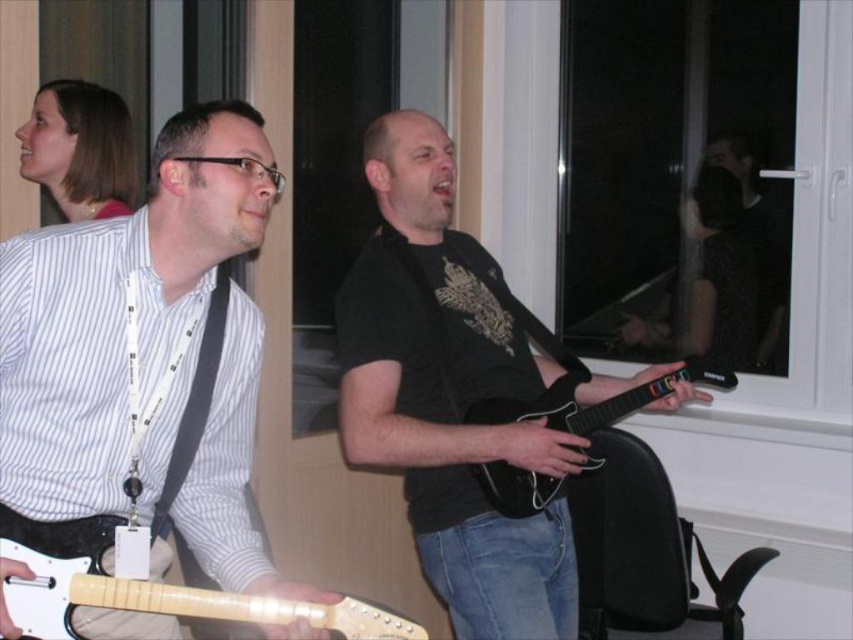
Question: Which point appears farthest from the camera in this image?

Choices:
 (A) (523, 628)
 (B) (149, 291)

Answer: (A)

Question: Can you confirm if black matte guitar at center is positioned above light wood electric guitar at lower left?

Choices:
 (A) yes
 (B) no

Answer: (A)

Question: Can you confirm if black matte guitar at center is positioned below black glossy electric guitar at center?

Choices:
 (A) yes
 (B) no

Answer: (B)

Question: Estimate the real-world distances between objects in this image. Which object is closer to the black glossy electric guitar at center?

Choices:
 (A) black matte guitar at center
 (B) white glossy guitar at left

Answer: (A)

Question: Is white glossy guitar at left behind light wood electric guitar at lower left?

Choices:
 (A) no
 (B) yes

Answer: (A)

Question: Based on their relative distances, which object is farther from the black glossy electric guitar at center?

Choices:
 (A) black matte guitar at center
 (B) light wood electric guitar at lower left

Answer: (B)